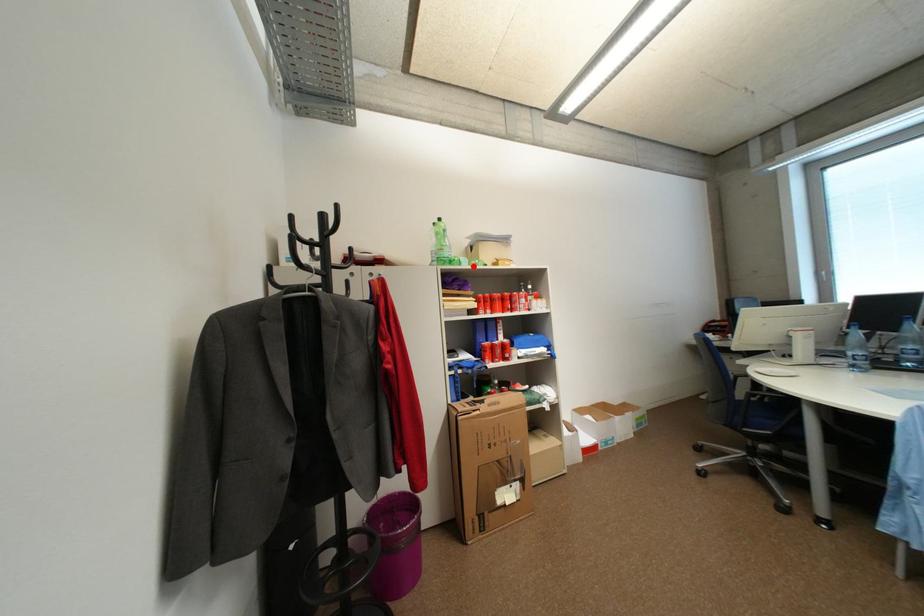
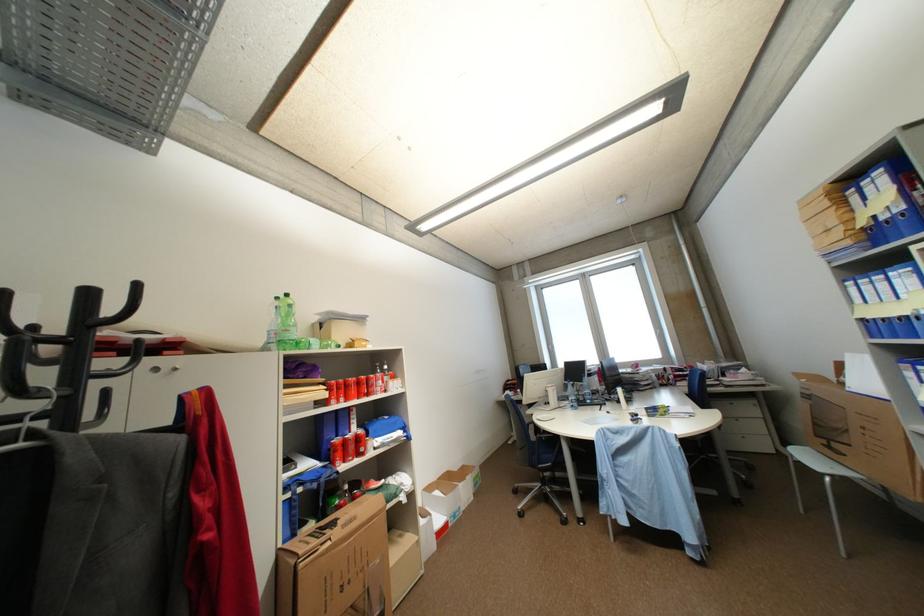
In the second image, find the point that corresponds to the highlighted location in the first image.

(323, 349)